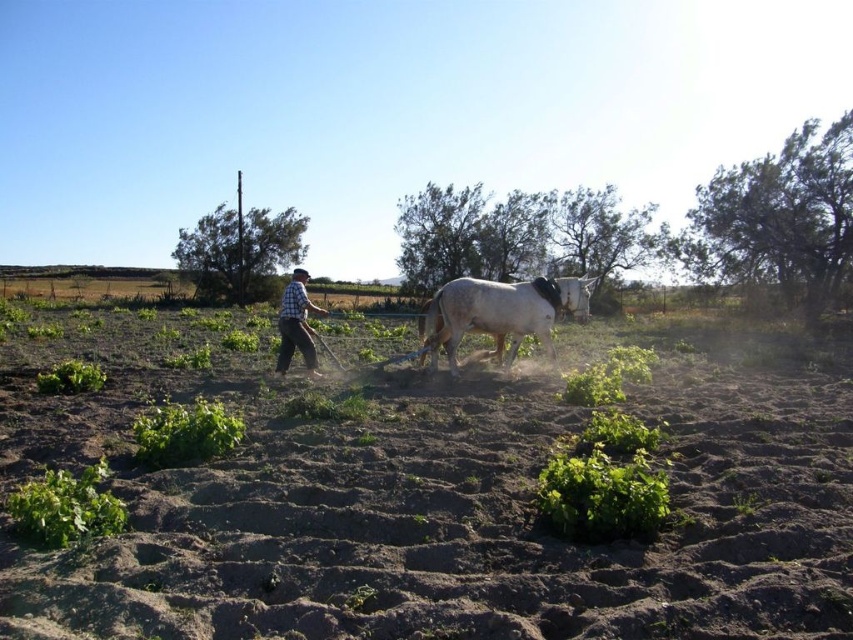
Question: Which of these objects is positioned farthest from the checkered fabric shirt at center?

Choices:
 (A) white matte horse at center
 (B) brown soil at center

Answer: (B)

Question: Which object is farther from the camera taking this photo?

Choices:
 (A) checkered fabric shirt at center
 (B) white matte horse at center
 (C) brown soil at center

Answer: (B)

Question: Considering the relative positions of brown soil at center and white matte horse at center in the image provided, where is brown soil at center located with respect to white matte horse at center?

Choices:
 (A) left
 (B) right

Answer: (A)

Question: Does brown soil at center have a smaller size compared to white matte horse at center?

Choices:
 (A) no
 (B) yes

Answer: (A)

Question: Which object appears farthest from the camera in this image?

Choices:
 (A) brown soil at center
 (B) checkered fabric shirt at center

Answer: (B)

Question: Considering the relative positions of brown soil at center and white matte horse at center in the image provided, where is brown soil at center located with respect to white matte horse at center?

Choices:
 (A) right
 (B) left

Answer: (B)